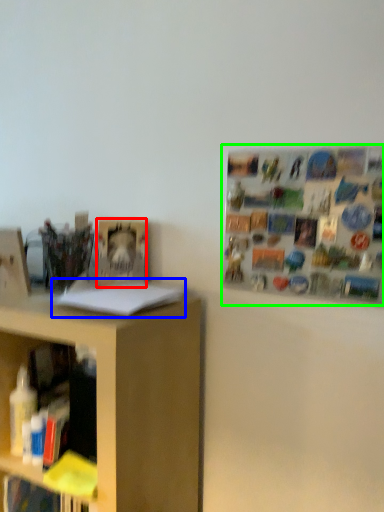
Question: Estimate the real-world distances between objects in this image. Which object is closer to book (highlighted by a red box), book (highlighted by a blue box) or bulletin board (highlighted by a green box)?

Choices:
 (A) book
 (B) bulletin board

Answer: (A)